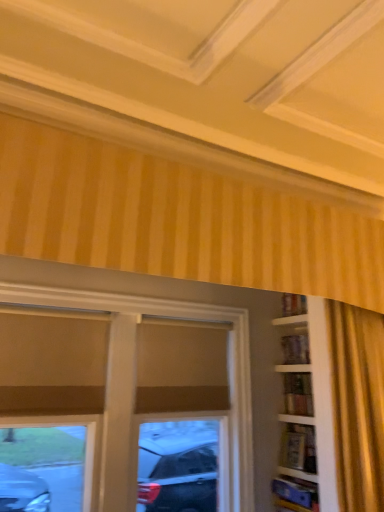
Question: From the image's perspective, is wooden bookshelf at right, marked as the first shelf in a bottom-to-top arrangement, over matte brown window at center?

Choices:
 (A) no
 (B) yes

Answer: (A)

Question: Considering the relative sizes of wooden bookshelf at right, which appears as the 2th shelf when viewed from the top, and matte brown window at center in the image provided, is wooden bookshelf at right, which appears as the 2th shelf when viewed from the top, thinner than matte brown window at center?

Choices:
 (A) yes
 (B) no

Answer: (B)

Question: Is wooden bookshelf at right, marked as the first shelf in a bottom-to-top arrangement, outside of matte brown window at center?

Choices:
 (A) yes
 (B) no

Answer: (A)

Question: Is wooden bookshelf at right, which appears as the 2th shelf when viewed from the top, oriented towards matte brown window at center?

Choices:
 (A) no
 (B) yes

Answer: (A)

Question: Considering the relative sizes of wooden bookshelf at right, marked as the first shelf in a bottom-to-top arrangement, and matte brown window at center in the image provided, is wooden bookshelf at right, marked as the first shelf in a bottom-to-top arrangement, smaller than matte brown window at center?

Choices:
 (A) no
 (B) yes

Answer: (B)

Question: Is wooden bookshelf at right, marked as the first shelf in a bottom-to-top arrangement, positioned with its back to matte brown window at center?

Choices:
 (A) no
 (B) yes

Answer: (A)

Question: Can you confirm if matte brown window at center is shorter than wooden bookshelf at right, which appears as the 2th shelf when ordered from the bottom?

Choices:
 (A) yes
 (B) no

Answer: (B)

Question: Is matte brown window at center oriented away from wooden bookshelf at right, which appears as the 2th shelf when ordered from the bottom?

Choices:
 (A) no
 (B) yes

Answer: (A)

Question: Considering the relative positions of matte brown window at center and wooden bookshelf at right, which appears as the 2th shelf when ordered from the bottom, in the image provided, is matte brown window at center to the right of wooden bookshelf at right, which appears as the 2th shelf when ordered from the bottom, from the viewer's perspective?

Choices:
 (A) no
 (B) yes

Answer: (A)

Question: Are matte brown window at center and wooden bookshelf at right, which is counted as the 1th shelf, starting from the top, located far from each other?

Choices:
 (A) no
 (B) yes

Answer: (A)

Question: Is matte brown window at center in contact with wooden bookshelf at right, which is counted as the 1th shelf, starting from the top?

Choices:
 (A) no
 (B) yes

Answer: (A)

Question: From a real-world perspective, is matte brown window at center on wooden bookshelf at right, which appears as the 2th shelf when ordered from the bottom?

Choices:
 (A) yes
 (B) no

Answer: (B)

Question: From the image's perspective, is wooden bookshelf at right, which appears as the 2th shelf when ordered from the bottom, located above wooden bookshelf at right, which appears as the 2th shelf when viewed from the top?

Choices:
 (A) no
 (B) yes

Answer: (B)